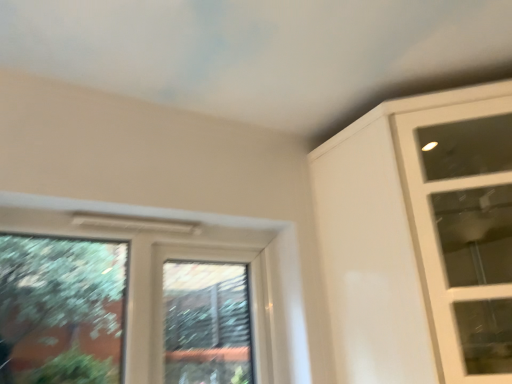
What do you see at coordinates (130, 301) in the screenshot? The height and width of the screenshot is (384, 512). I see `clear glass window at left` at bounding box center [130, 301].

Where is `clear glass window at left`? The height and width of the screenshot is (384, 512). clear glass window at left is located at coordinates (130, 301).

This screenshot has height=384, width=512. Identify the location of clear glass window at left. (130, 301).